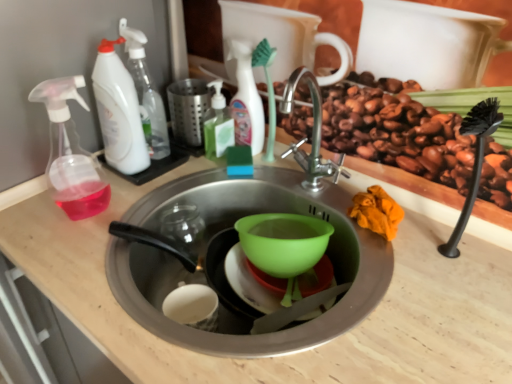
Identify the location of free space on the front side of green liquid soap at upper center, positioned as the second cleaning product in right-to-left order. (198, 181).